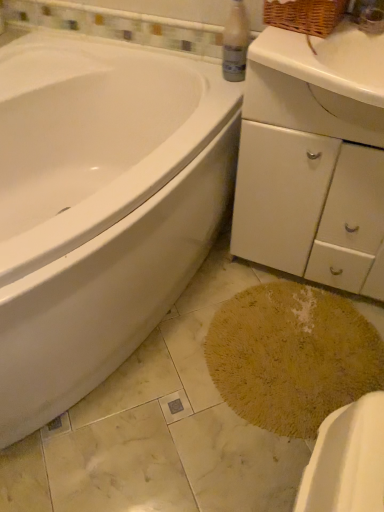
Question: Can you confirm if white matte cabinet at center-right is positioned to the left of yellow textured bath mat at lower center?

Choices:
 (A) no
 (B) yes

Answer: (A)

Question: Is white matte cabinet at center-right smaller than yellow textured bath mat at lower center?

Choices:
 (A) yes
 (B) no

Answer: (B)

Question: Is white matte cabinet at center-right not inside yellow textured bath mat at lower center?

Choices:
 (A) yes
 (B) no

Answer: (A)

Question: Is white matte cabinet at center-right positioned with its back to yellow textured bath mat at lower center?

Choices:
 (A) yes
 (B) no

Answer: (B)

Question: Can you confirm if white matte cabinet at center-right is bigger than yellow textured bath mat at lower center?

Choices:
 (A) yes
 (B) no

Answer: (A)

Question: Can you confirm if white matte cabinet at center-right is wider than yellow textured bath mat at lower center?

Choices:
 (A) no
 (B) yes

Answer: (A)

Question: From a real-world perspective, is woven brown basket at upper right beneath white glossy bathtub at left?

Choices:
 (A) no
 (B) yes

Answer: (A)

Question: Does woven brown basket at upper right have a larger size compared to white glossy bathtub at left?

Choices:
 (A) no
 (B) yes

Answer: (A)

Question: From the image's perspective, would you say woven brown basket at upper right is positioned over white glossy bathtub at left?

Choices:
 (A) no
 (B) yes

Answer: (B)

Question: Does woven brown basket at upper right have a greater width compared to white glossy bathtub at left?

Choices:
 (A) no
 (B) yes

Answer: (A)

Question: Can you confirm if woven brown basket at upper right is positioned to the left of white glossy bathtub at left?

Choices:
 (A) no
 (B) yes

Answer: (A)

Question: Are woven brown basket at upper right and white glossy bathtub at left making contact?

Choices:
 (A) yes
 (B) no

Answer: (B)

Question: Does yellow textured bath mat at lower center have a larger size compared to yellow textured rug at lower center?

Choices:
 (A) yes
 (B) no

Answer: (B)